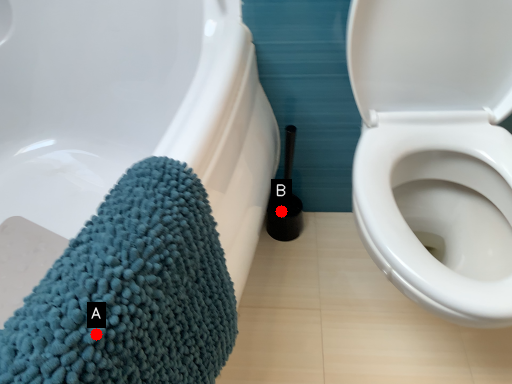
Question: Two points are circled on the image, labeled by A and B beside each circle. Which of the following is the farthest from the observer?

Choices:
 (A) A is further
 (B) B is further

Answer: (B)